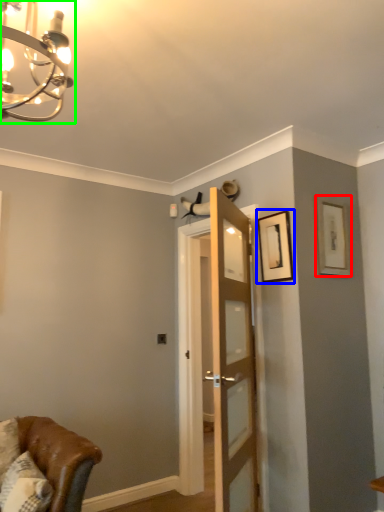
Question: Estimate the real-world distances between objects in this image. Which object is farther from picture frame (highlighted by a red box), picture frame (highlighted by a blue box) or light fixture (highlighted by a green box)?

Choices:
 (A) picture frame
 (B) light fixture

Answer: (B)